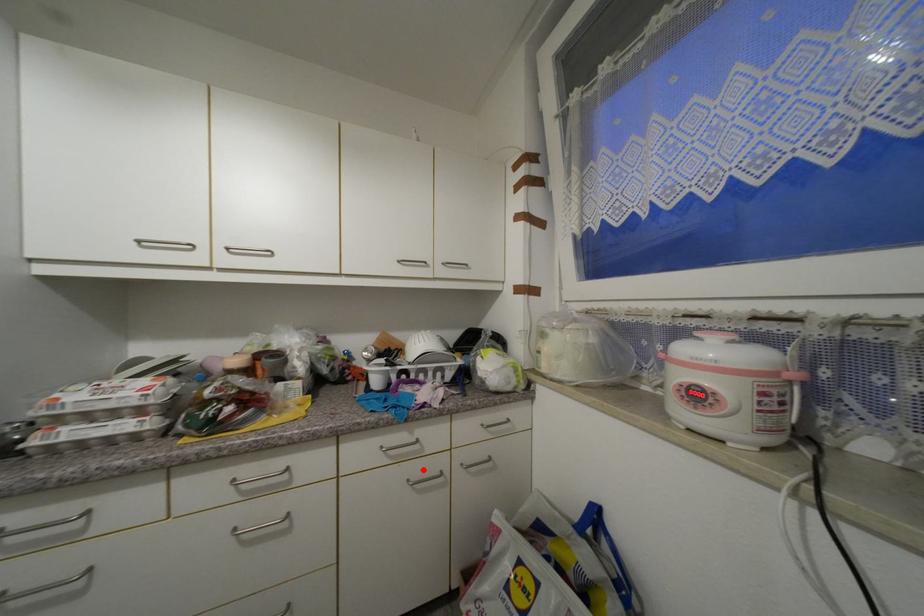
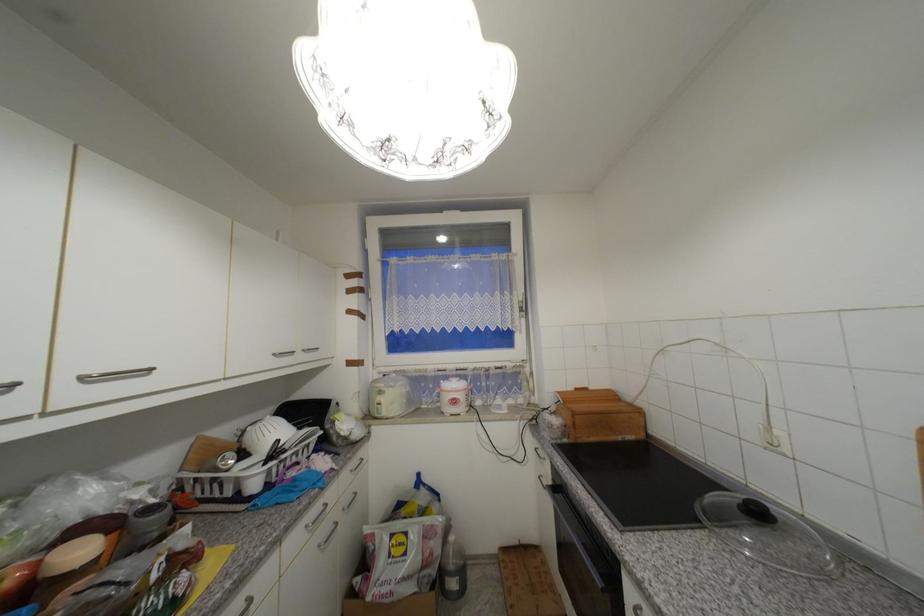
The point at the highlighted location is marked in the first image. Where is the corresponding point in the second image?

(330, 531)